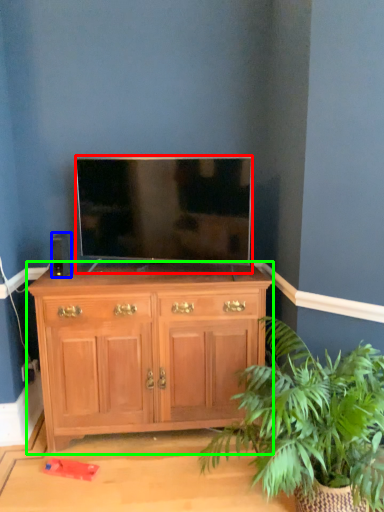
Question: Which is farther away from television (highlighted by a red box)? speaker (highlighted by a blue box) or chest of drawers (highlighted by a green box)?

Choices:
 (A) speaker
 (B) chest of drawers

Answer: (A)